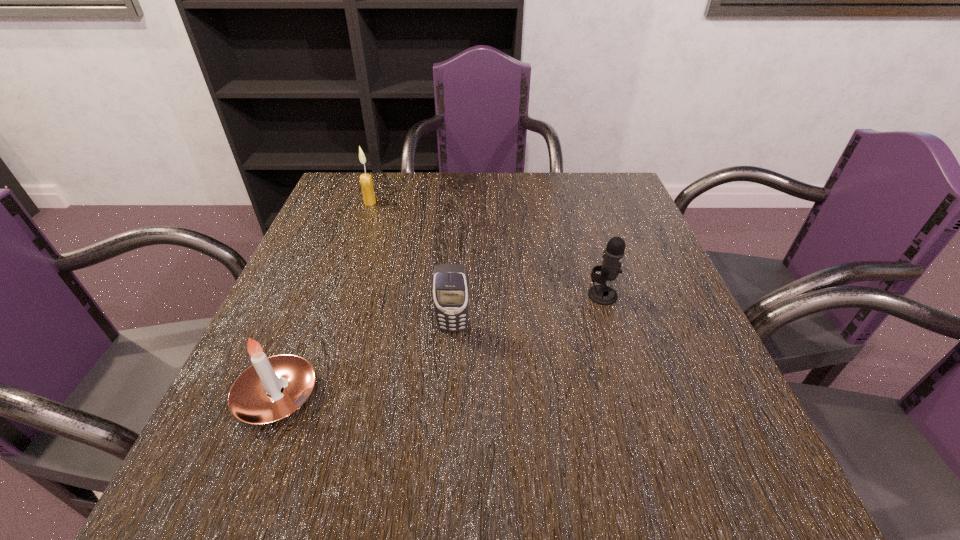
In order to click on the farther candle in this screenshot , I will do `click(366, 182)`.

Where is `the third object from left to right`? The width and height of the screenshot is (960, 540). the third object from left to right is located at coordinates (450, 290).

In order to click on cellular telephone in this screenshot , I will do `click(450, 290)`.

Locate an element on the screen. the rightmost object is located at coordinates (602, 294).

Find the location of a particular element. This screenshot has width=960, height=540. the third nearest object is located at coordinates (602, 294).

You are a GUI agent. You are given a task and a screenshot of the screen. Output one action in this format:
    pyautogui.click(x=<x>, y=<y>)
    Task: Click on the nearest object
    The image size is (960, 540).
    Given the screenshot: What is the action you would take?
    pyautogui.click(x=272, y=388)

You are a GUI agent. You are given a task and a screenshot of the screen. Output one action in this format:
    pyautogui.click(x=<x>, y=<y>)
    Task: Click on the blank area located on the right of the farthest object
    
    Given the screenshot: What is the action you would take?
    pos(468,202)

Find the location of a particular element. free spot located 0.210m on the front face of the second object from right to left is located at coordinates coord(446,436).

Where is `free space located 0.300m on the back of the third nearest object`? The width and height of the screenshot is (960, 540). free space located 0.300m on the back of the third nearest object is located at coordinates (577, 210).

The width and height of the screenshot is (960, 540). Identify the location of vacant point located 0.120m on the front of the nearer candle. (229, 515).